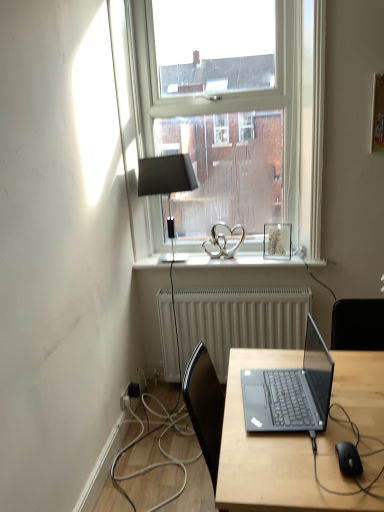
This screenshot has width=384, height=512. In order to click on free spot below matte black lamp at upper center (from a real-world perspective) in this screenshot , I will do `click(183, 255)`.